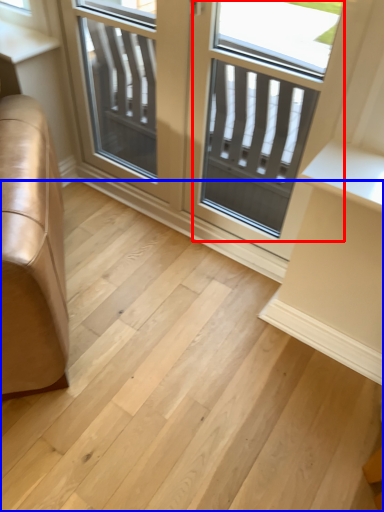
Question: Among these objects, which one is farthest to the camera, screen door (highlighted by a red box) or stairwell (highlighted by a blue box)?

Choices:
 (A) screen door
 (B) stairwell

Answer: (A)